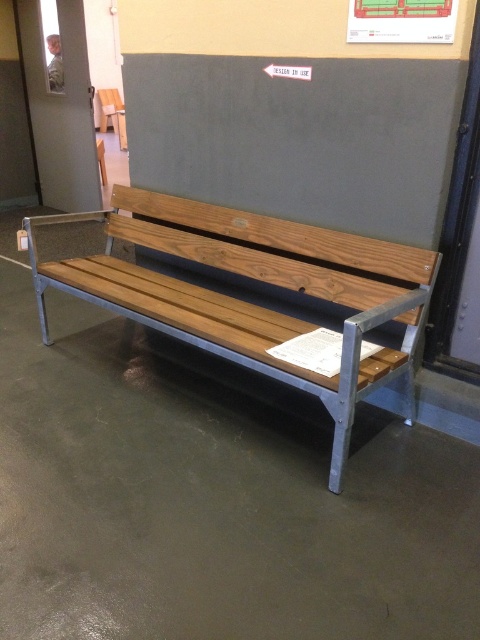
Question: Considering the relative positions of wooden bench at center and matte white paper at upper center in the image provided, where is wooden bench at center located with respect to matte white paper at upper center?

Choices:
 (A) left
 (B) right

Answer: (A)

Question: Can you confirm if wooden bench at center is positioned to the left of matte white paper at upper center?

Choices:
 (A) no
 (B) yes

Answer: (B)

Question: Does wooden bench at center have a greater width compared to matte white paper at upper center?

Choices:
 (A) yes
 (B) no

Answer: (A)

Question: Which point is farther to the camera?

Choices:
 (A) matte white paper at upper center
 (B) wooden bench at center

Answer: (A)

Question: Which point appears farthest from the camera in this image?

Choices:
 (A) (418, 28)
 (B) (268, 342)

Answer: (B)